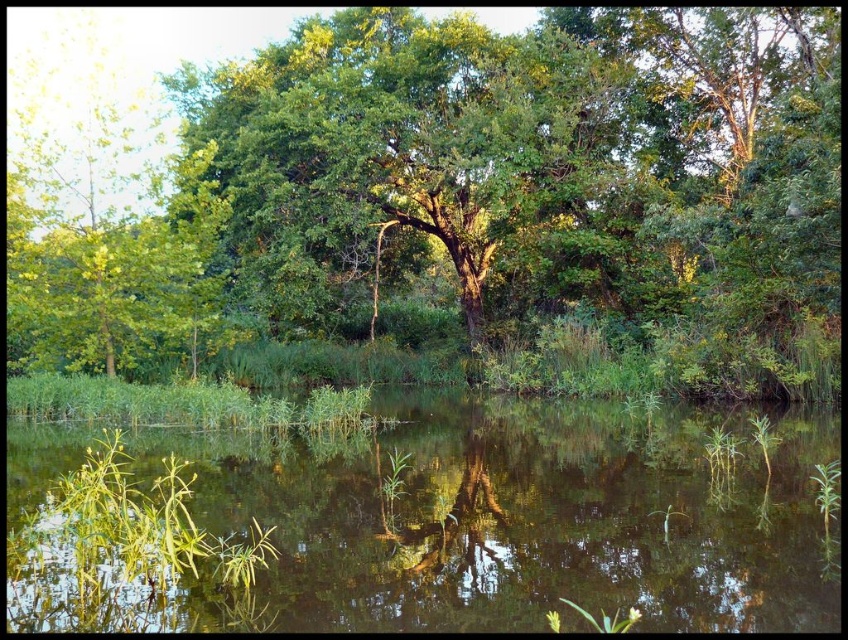
Can you confirm if green leafy tree at center is thinner than green matte tree at center?

No, green leafy tree at center is not thinner than green matte tree at center.

Between point (809, 45) and point (494, 518), which one is positioned behind?

The point (809, 45) is behind.

Image resolution: width=848 pixels, height=640 pixels. I want to click on green leafy tree at center, so click(x=452, y=189).

Identify the location of green leafy tree at center. (452, 189).

Is green leafy tree at center smaller than green grassy lake at center?

No.

Which is above, green leafy tree at center or green grassy lake at center?

Positioned higher is green leafy tree at center.

Does point (238, 253) come in front of point (484, 445)?

No, it is behind (484, 445).

At what (x,y) coordinates should I click in order to perform the action: click on green leafy tree at center. Please return your answer as a coordinate pair (x, y). Looking at the image, I should click on (452, 189).

In the scene shown: Can you confirm if green grassy lake at center is positioned below green matte tree at center?

No, green grassy lake at center is not below green matte tree at center.

Does green grassy lake at center have a lesser width compared to green matte tree at center?

No, green grassy lake at center is not thinner than green matte tree at center.

Is point (282, 628) positioned in front of point (489, 490)?

Yes, point (282, 628) is closer to viewer.

You are a GUI agent. You are given a task and a screenshot of the screen. Output one action in this format:
    pyautogui.click(x=<x>, y=<y>)
    Task: Click on the green grassy lake at center
    The image size is (848, 640).
    Given the screenshot: What is the action you would take?
    pyautogui.click(x=522, y=518)